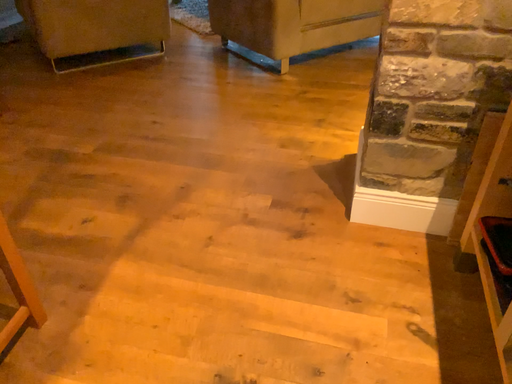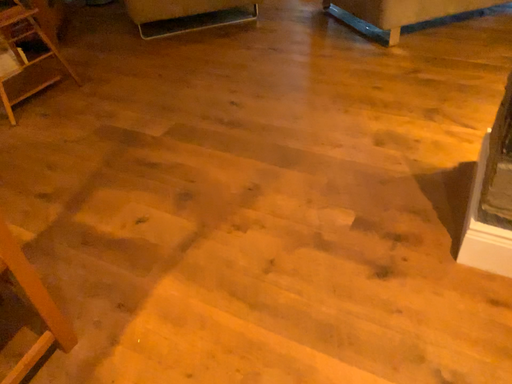
Question: How did the camera likely rotate when shooting the video?

Choices:
 (A) rotated left
 (B) rotated right

Answer: (A)